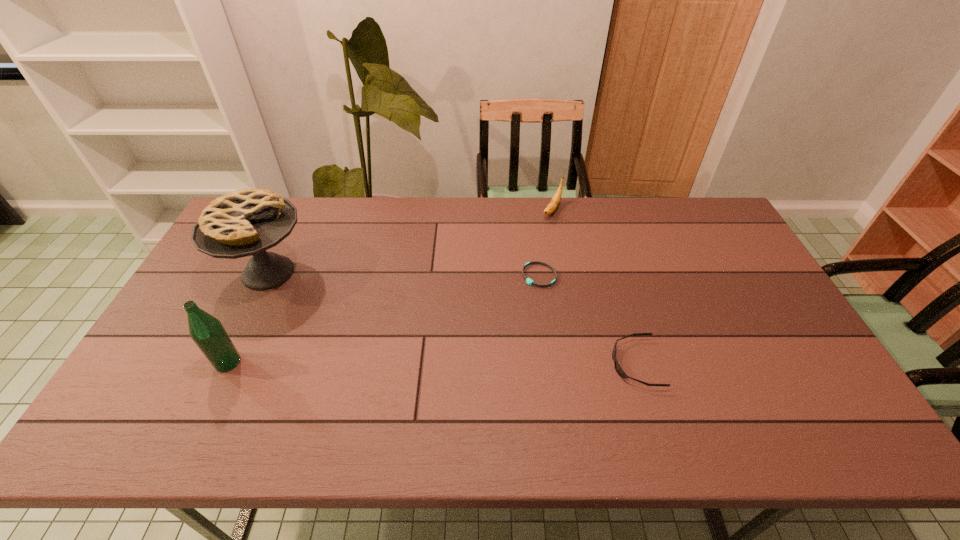
Locate an element on the screen. The width and height of the screenshot is (960, 540). object that is at the far edge is located at coordinates (554, 203).

This screenshot has height=540, width=960. Find the location of `bottle situated at the near edge`. bottle situated at the near edge is located at coordinates (207, 332).

Locate an element on the screen. The height and width of the screenshot is (540, 960). sunglasses at the near edge is located at coordinates (619, 370).

Locate an element on the screen. object that is positioned at the left edge is located at coordinates (247, 222).

Locate an element on the screen. vacant space at the far edge of the desktop is located at coordinates (340, 204).

Find the location of `free space at the near edge of the desktop`. free space at the near edge of the desktop is located at coordinates (755, 396).

Locate an element on the screen. The height and width of the screenshot is (540, 960). free space at the far left corner of the desktop is located at coordinates (290, 200).

Image resolution: width=960 pixels, height=540 pixels. Find the location of `free space between the fourth tallest object and the pie`. free space between the fourth tallest object and the pie is located at coordinates (452, 318).

The height and width of the screenshot is (540, 960). I want to click on unoccupied area between the bottle and the rightmost object, so click(432, 363).

Where is `empty space that is in between the pie and the shortest object`? empty space that is in between the pie and the shortest object is located at coordinates (404, 274).